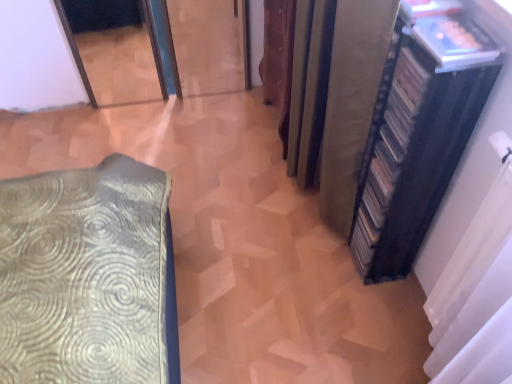
You are a GUI agent. You are given a task and a screenshot of the screen. Output one action in this format:
    pyautogui.click(x=<x>, y=<y>)
    Task: Click on the free space in front of silky beige curtain at right, placed as the 2th curtain when sorted from right to left
    The image size is (512, 384).
    Given the screenshot: What is the action you would take?
    pyautogui.click(x=301, y=268)